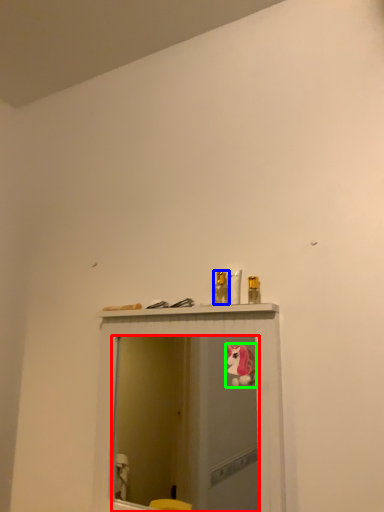
Question: Which object is positioned closest to mirror (highlighted by a red box)? Select from toiletry (highlighted by a blue box) and animal (highlighted by a green box).

Choices:
 (A) toiletry
 (B) animal

Answer: (B)